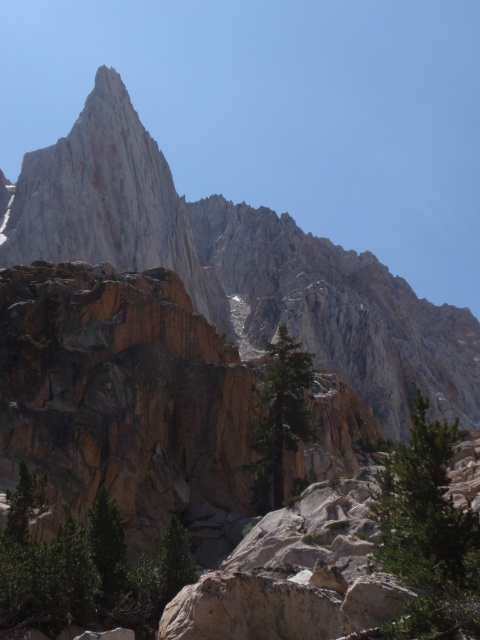
Is rugged granite peak at upper center wider than green matte tree at lower left?

Correct, the width of rugged granite peak at upper center exceeds that of green matte tree at lower left.

Can you confirm if rugged granite peak at upper center is smaller than green matte tree at lower left?

Actually, rugged granite peak at upper center might be larger than green matte tree at lower left.

Is point (289, 321) farther from camera compared to point (95, 515)?

Yes.

You are a GUI agent. You are given a task and a screenshot of the screen. Output one action in this format:
    pyautogui.click(x=<x>, y=<y>)
    Task: Click on the rugged granite peak at upper center
    Image resolution: width=480 pixels, height=640 pixels.
    Given the screenshot: What is the action you would take?
    pyautogui.click(x=240, y=262)

Is point (24, 490) positioned after point (278, 403)?

That is False.

Can you confirm if green matte tree at lower left is taller than green textured tree at center?

No.

Is point (113, 589) more distant than point (268, 476)?

That is False.

The width and height of the screenshot is (480, 640). I want to click on green matte tree at lower left, so click(x=84, y=564).

Can you confirm if rugged granite peak at upper center is positioned to the left of green textured rock at lower right?

Yes, rugged granite peak at upper center is to the left of green textured rock at lower right.

What do you see at coordinates (240, 262) in the screenshot? I see `rugged granite peak at upper center` at bounding box center [240, 262].

Is point (285, 314) closer to viewer compared to point (439, 512)?

That is False.

You are a GUI agent. You are given a task and a screenshot of the screen. Output one action in this format:
    pyautogui.click(x=<x>, y=<y>)
    Task: Click on the rugged granite peak at upper center
    The width and height of the screenshot is (480, 640).
    Given the screenshot: What is the action you would take?
    pyautogui.click(x=240, y=262)